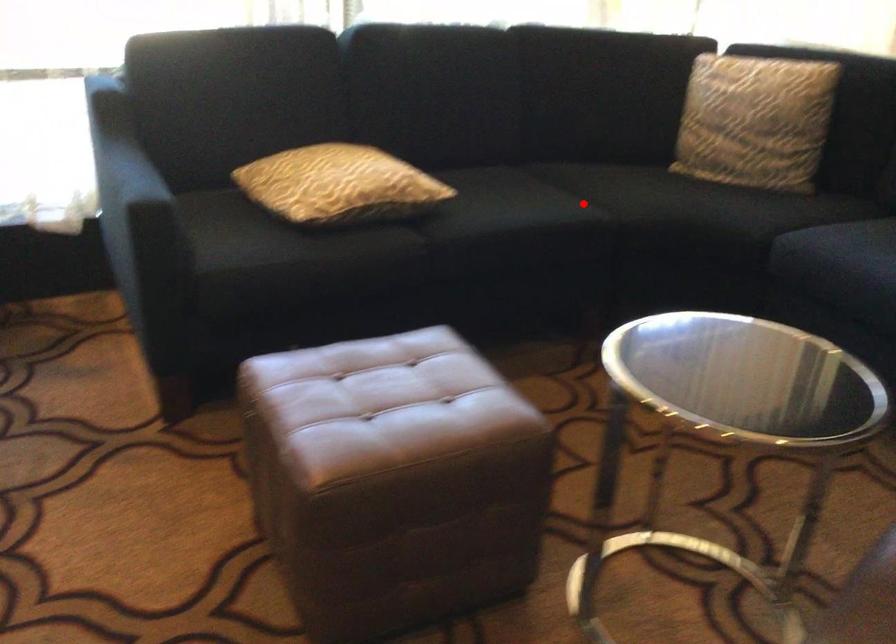
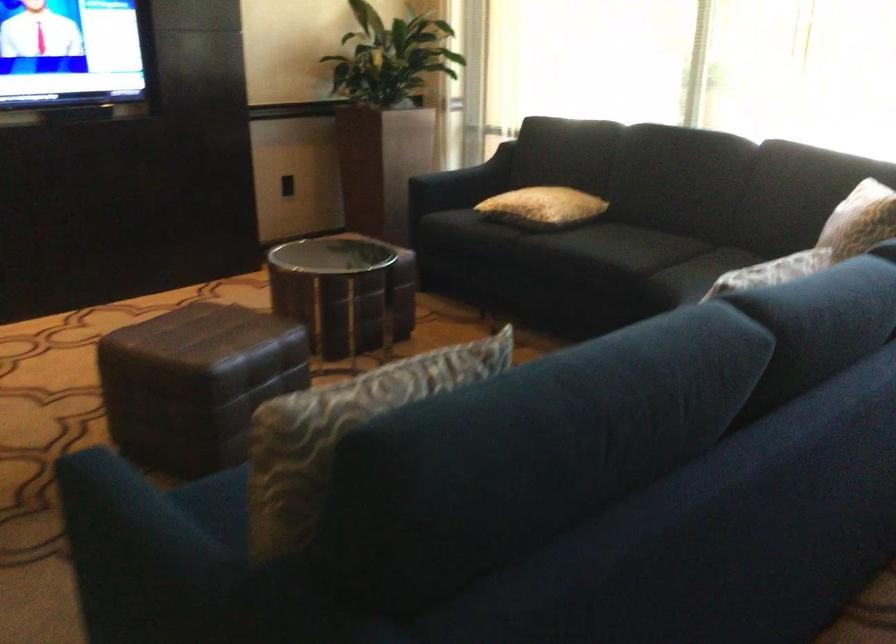
Question: I am providing you with two images of the same scene from different viewpoints. Given a red point in image1, look at the same physical point in image2. Is it:

Choices:
 (A) Closer to the viewpoint
 (B) Farther from the viewpoint

Answer: (B)